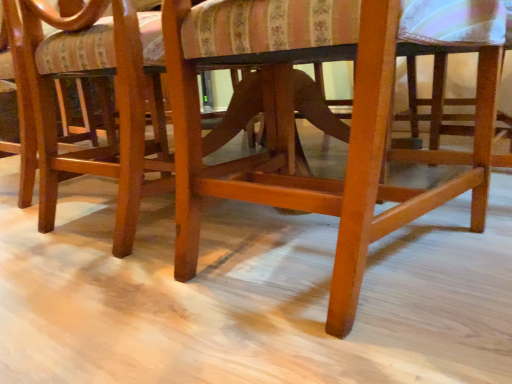
Identify the location of wooden chair at center, positioned as the second chair in left-to-right order. The height and width of the screenshot is (384, 512). (351, 121).

This screenshot has height=384, width=512. Describe the element at coordinates (351, 121) in the screenshot. I see `wooden chair at center, positioned as the second chair in left-to-right order` at that location.

Measure the distance between point (340, 181) and camera.

A distance of 1.38 meters exists between point (340, 181) and camera.

In order to face glossy wood chair at center, the 1th chair from the left, should I rotate leftwards or rightwards?

You should look left and rotate roughly 14.323 degrees.

The width and height of the screenshot is (512, 384). Describe the element at coordinates (115, 99) in the screenshot. I see `glossy wood chair at center, positioned as the second chair in right-to-left order` at that location.

Locate an element on the screen. This screenshot has height=384, width=512. glossy wood chair at center, positioned as the second chair in right-to-left order is located at coordinates (115, 99).

This screenshot has width=512, height=384. In order to click on wooden chair at center, which is the first chair from right to left in this screenshot , I will do `click(351, 121)`.

In the scene shown: Does glossy wood chair at center, positioned as the second chair in right-to-left order, appear on the left side of wooden chair at center, positioned as the second chair in left-to-right order?

Indeed, glossy wood chair at center, positioned as the second chair in right-to-left order, is positioned on the left side of wooden chair at center, positioned as the second chair in left-to-right order.

Considering their positions, is glossy wood chair at center, the 1th chair from the left, located in front of or behind wooden chair at center, which is the first chair from right to left?

glossy wood chair at center, the 1th chair from the left, is behind wooden chair at center, which is the first chair from right to left.

Is point (55, 38) closer to camera compared to point (380, 238)?

That is False.

From the image's perspective, which is below, glossy wood chair at center, positioned as the second chair in right-to-left order, or wooden chair at center, which is the first chair from right to left?

wooden chair at center, which is the first chair from right to left, appears lower in the image.

From a real-world perspective, is glossy wood chair at center, positioned as the second chair in right-to-left order, on wooden chair at center, positioned as the second chair in left-to-right order?

Correct, in the physical world, glossy wood chair at center, positioned as the second chair in right-to-left order, is higher than wooden chair at center, positioned as the second chair in left-to-right order.

Considering the sizes of objects glossy wood chair at center, positioned as the second chair in right-to-left order, and wooden chair at center, which is the first chair from right to left, in the image provided, who is wider, glossy wood chair at center, positioned as the second chair in right-to-left order, or wooden chair at center, which is the first chair from right to left,?

wooden chair at center, which is the first chair from right to left.

Considering the sizes of objects glossy wood chair at center, the 1th chair from the left, and wooden chair at center, which is the first chair from right to left, in the image provided, who is shorter, glossy wood chair at center, the 1th chair from the left, or wooden chair at center, which is the first chair from right to left,?

wooden chair at center, which is the first chair from right to left, is shorter.

Can you confirm if glossy wood chair at center, the 1th chair from the left, is bigger than wooden chair at center, which is the first chair from right to left?

Yes, glossy wood chair at center, the 1th chair from the left, is bigger than wooden chair at center, which is the first chair from right to left.

Is glossy wood chair at center, the 1th chair from the left, completely or partially outside of wooden chair at center, positioned as the second chair in left-to-right order?

That's correct, glossy wood chair at center, the 1th chair from the left, is outside of wooden chair at center, positioned as the second chair in left-to-right order.

Is glossy wood chair at center, positioned as the second chair in right-to-left order, next to wooden chair at center, positioned as the second chair in left-to-right order?

There is a gap between glossy wood chair at center, positioned as the second chair in right-to-left order, and wooden chair at center, positioned as the second chair in left-to-right order.

Is glossy wood chair at center, the 1th chair from the left, oriented away from wooden chair at center, which is the first chair from right to left?

No.

This screenshot has width=512, height=384. I want to click on chair located above the wooden chair at center, which is the first chair from right to left (from a real-world perspective), so click(x=115, y=99).

Is wooden chair at center, which is the first chair from right to left, at the right side of glossy wood chair at center, the 1th chair from the left?

Answer: Correct, you'll find wooden chair at center, which is the first chair from right to left, to the right of glossy wood chair at center, the 1th chair from the left.

Which is in front, wooden chair at center, which is the first chair from right to left, or glossy wood chair at center, the 1th chair from the left?

wooden chair at center, which is the first chair from right to left, is more forward.

Between point (332, 5) and point (36, 123), which one is positioned in front?

The point (332, 5) is closer to the camera.

From the image's perspective, is wooden chair at center, which is the first chair from right to left, beneath glossy wood chair at center, the 1th chair from the left?

Yes.

From a real-world perspective, who is located higher, wooden chair at center, positioned as the second chair in left-to-right order, or glossy wood chair at center, the 1th chair from the left?

In real-world perspective, glossy wood chair at center, the 1th chair from the left, is above.

Which object is thinner, wooden chair at center, positioned as the second chair in left-to-right order, or glossy wood chair at center, the 1th chair from the left?

With smaller width is glossy wood chair at center, the 1th chair from the left.

Considering the relative sizes of wooden chair at center, positioned as the second chair in left-to-right order, and glossy wood chair at center, the 1th chair from the left, in the image provided, is wooden chair at center, positioned as the second chair in left-to-right order, shorter than glossy wood chair at center, the 1th chair from the left,?

Yes.

Considering the sizes of objects wooden chair at center, which is the first chair from right to left, and glossy wood chair at center, the 1th chair from the left, in the image provided, who is smaller, wooden chair at center, which is the first chair from right to left, or glossy wood chair at center, the 1th chair from the left,?

wooden chair at center, which is the first chair from right to left, is smaller.

Is wooden chair at center, positioned as the second chair in left-to-right order, not inside glossy wood chair at center, the 1th chair from the left?

Indeed, wooden chair at center, positioned as the second chair in left-to-right order, is completely outside glossy wood chair at center, the 1th chair from the left.

Can you see wooden chair at center, which is the first chair from right to left, touching glossy wood chair at center, the 1th chair from the left?

No, wooden chair at center, which is the first chair from right to left, is not in contact with glossy wood chair at center, the 1th chair from the left.

Is wooden chair at center, positioned as the second chair in left-to-right order, turned away from glossy wood chair at center, the 1th chair from the left?

No, glossy wood chair at center, the 1th chair from the left, is not at the back of wooden chair at center, positioned as the second chair in left-to-right order.

Based on the photo, how distant is wooden chair at center, which is the first chair from right to left, from glossy wood chair at center, the 1th chair from the left?

A distance of 14.43 inches exists between wooden chair at center, which is the first chair from right to left, and glossy wood chair at center, the 1th chair from the left.

You are a GUI agent. You are given a task and a screenshot of the screen. Output one action in this format:
    pyautogui.click(x=<x>, y=<y>)
    Task: Click on the chair on the left of wooden chair at center, which is the first chair from right to left
    This screenshot has width=512, height=384.
    Given the screenshot: What is the action you would take?
    pyautogui.click(x=115, y=99)

At what (x,y) coordinates should I click in order to perform the action: click on chair beneath the glossy wood chair at center, positioned as the second chair in right-to-left order (from a real-world perspective). Please return your answer as a coordinate pair (x, y). The height and width of the screenshot is (384, 512). Looking at the image, I should click on [x=351, y=121].

The height and width of the screenshot is (384, 512). I want to click on chair on the left side of wooden chair at center, which is the first chair from right to left, so click(115, 99).